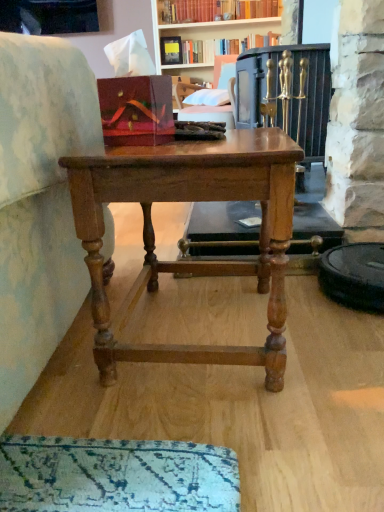
Question: From a real-world perspective, is hardcover book at upper center under velvet pink cushion at upper center?

Choices:
 (A) yes
 (B) no

Answer: (B)

Question: Is hardcover book at upper center behind velvet pink cushion at upper center?

Choices:
 (A) no
 (B) yes

Answer: (B)

Question: Is hardcover book at upper center located outside velvet pink cushion at upper center?

Choices:
 (A) yes
 (B) no

Answer: (A)

Question: From the image's perspective, does hardcover book at upper center appear lower than velvet pink cushion at upper center?

Choices:
 (A) yes
 (B) no

Answer: (B)

Question: Would you say velvet pink cushion at upper center is part of hardcover book at upper center's contents?

Choices:
 (A) no
 (B) yes

Answer: (A)

Question: From the image's perspective, is hardcover book at upper center on velvet pink cushion at upper center?

Choices:
 (A) no
 (B) yes

Answer: (B)

Question: From the image's perspective, is velvet pink cushion at upper center beneath hardcover book at upper center?

Choices:
 (A) yes
 (B) no

Answer: (A)

Question: Can you confirm if velvet pink cushion at upper center is positioned to the right of hardcover book at upper center?

Choices:
 (A) yes
 (B) no

Answer: (B)

Question: From the image's perspective, would you say velvet pink cushion at upper center is positioned over hardcover book at upper center?

Choices:
 (A) no
 (B) yes

Answer: (A)

Question: Is velvet pink cushion at upper center located outside hardcover book at upper center?

Choices:
 (A) no
 (B) yes

Answer: (B)

Question: Can you confirm if velvet pink cushion at upper center is wider than hardcover book at upper center?

Choices:
 (A) no
 (B) yes

Answer: (B)

Question: Is the depth of velvet pink cushion at upper center less than that of hardcover book at upper center?

Choices:
 (A) no
 (B) yes

Answer: (B)

Question: Is wooden table at center in front of velvet pink cushion at upper center?

Choices:
 (A) yes
 (B) no

Answer: (A)